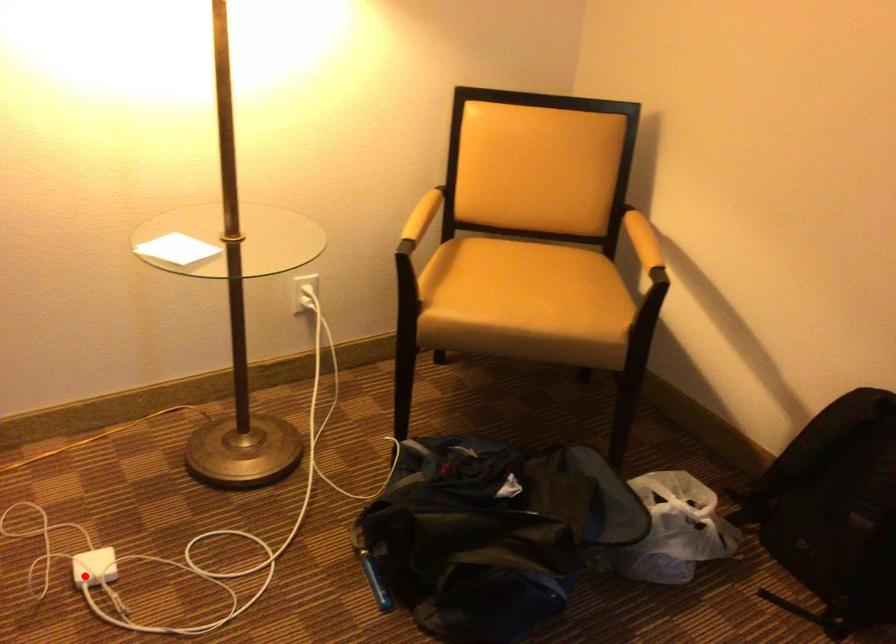
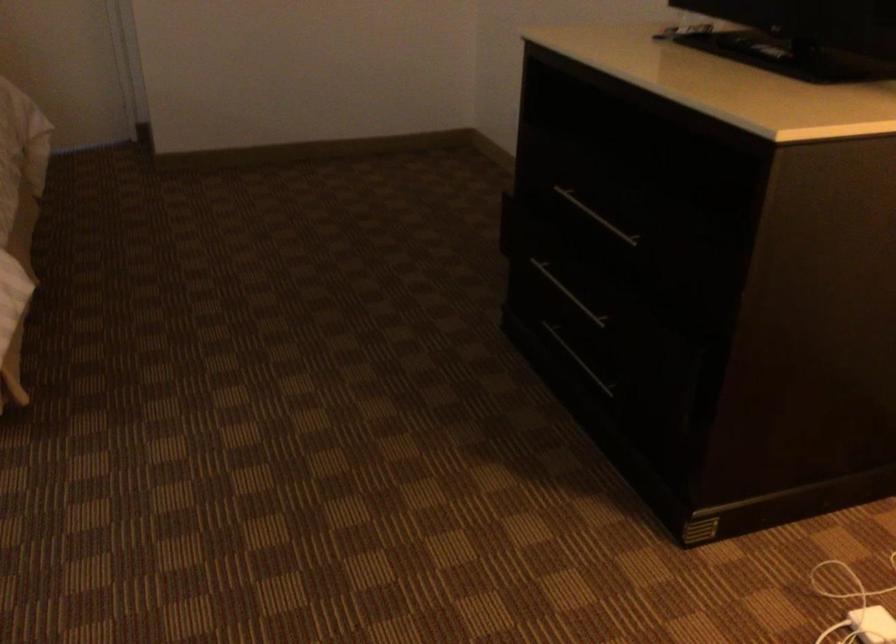
Locate, in the second image, the point that corresponds to the highlighted location in the first image.

(872, 625)